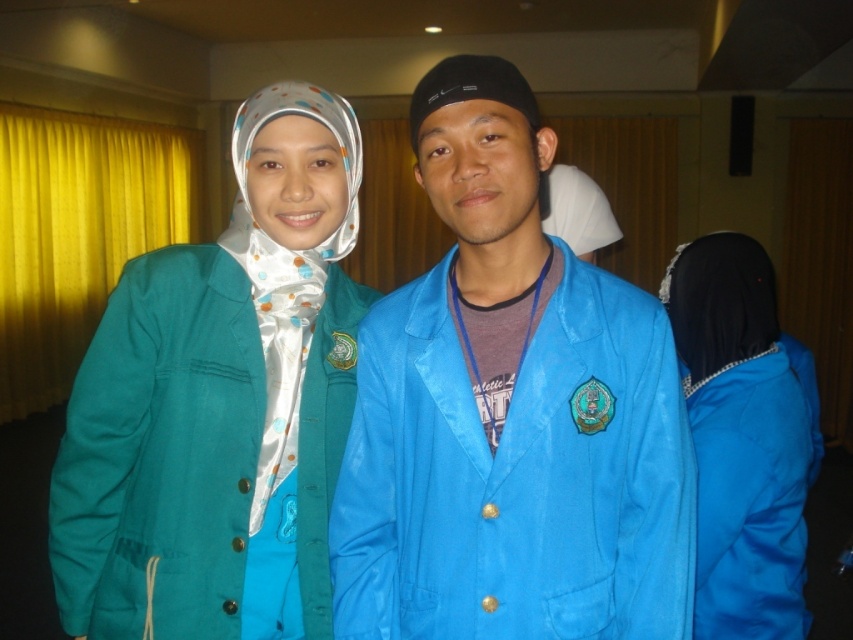
Question: Which point is closer to the camera?

Choices:
 (A) (801, 403)
 (B) (200, 164)

Answer: (A)

Question: Can you confirm if teal fabric hijab at left is bigger than yellow fabric curtain at left?

Choices:
 (A) no
 (B) yes

Answer: (A)

Question: Estimate the real-world distances between objects in this image. Which object is farther from the blue fabric jacket at center?

Choices:
 (A) yellow fabric curtain at left
 (B) teal fabric hijab at left
 (C) blue satin hijab at right

Answer: (A)

Question: Does blue fabric jacket at center have a larger size compared to blue satin hijab at right?

Choices:
 (A) yes
 (B) no

Answer: (B)

Question: Is blue fabric jacket at center behind teal fabric hijab at left?

Choices:
 (A) yes
 (B) no

Answer: (B)

Question: Which of the following is the closest to the observer?

Choices:
 (A) blue fabric jacket at center
 (B) yellow fabric curtain at left
 (C) blue satin hijab at right

Answer: (A)